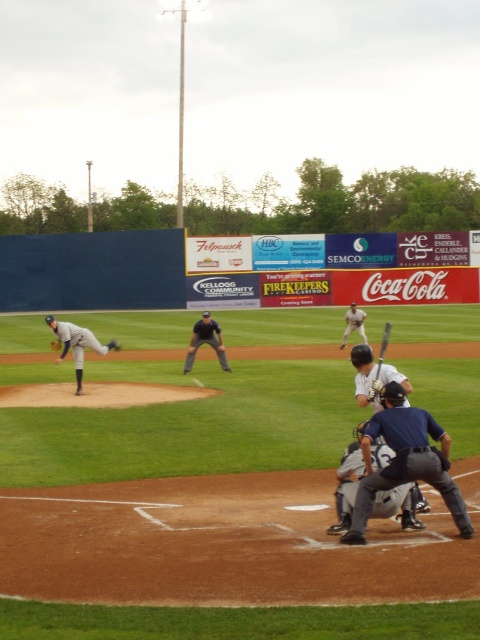
Question: Which object is farther from the camera taking this photo?

Choices:
 (A) dark blue leather glove at center
 (B) white matte baseball bat at center

Answer: (A)

Question: Observing the image, what is the correct spatial positioning of dark blue leather glove at center in reference to dark brown leather glove at left?

Choices:
 (A) above
 (B) below

Answer: (A)

Question: Is white matte baseball bat at center positioned before dark blue uniform at center?

Choices:
 (A) yes
 (B) no

Answer: (A)

Question: Which point is farther to the camera?

Choices:
 (A) gray uniformed pitcher at left
 (B) white jersey baseball bat at center

Answer: (B)

Question: Which of the following is the farthest from the observer?

Choices:
 (A) gray fabric catcher at lower center
 (B) dark blue uniform at center
 (C) wooden baseball bat at lower center

Answer: (B)

Question: Is white jersey baseball bat at center to the left of wooden baseball bat at lower center from the viewer's perspective?

Choices:
 (A) no
 (B) yes

Answer: (A)